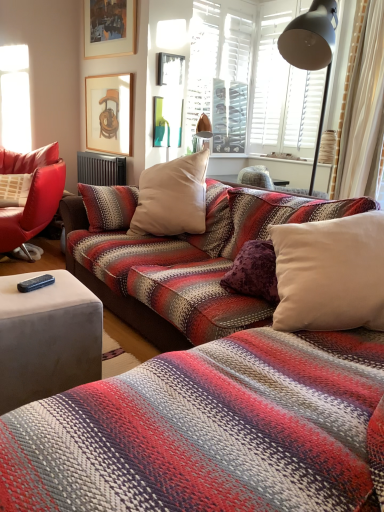
Question: Is wooden framed picture at upper left, the 3th picture frame in the top-to-bottom sequence, turned away from dark gray metallic radiator at center?

Choices:
 (A) yes
 (B) no

Answer: (B)

Question: Considering the relative positions of wooden framed picture at upper left, the first picture frame in the bottom-to-top sequence, and dark gray metallic radiator at center in the image provided, is wooden framed picture at upper left, the first picture frame in the bottom-to-top sequence, to the left of dark gray metallic radiator at center from the viewer's perspective?

Choices:
 (A) yes
 (B) no

Answer: (B)

Question: Is wooden framed picture at upper left, the first picture frame in the bottom-to-top sequence, smaller than dark gray metallic radiator at center?

Choices:
 (A) yes
 (B) no

Answer: (A)

Question: Considering the relative sizes of wooden framed picture at upper left, the first picture frame in the bottom-to-top sequence, and dark gray metallic radiator at center in the image provided, is wooden framed picture at upper left, the first picture frame in the bottom-to-top sequence, thinner than dark gray metallic radiator at center?

Choices:
 (A) no
 (B) yes

Answer: (B)

Question: Is wooden framed picture at upper left, the first picture frame in the bottom-to-top sequence, to the right of dark gray metallic radiator at center from the viewer's perspective?

Choices:
 (A) yes
 (B) no

Answer: (A)

Question: From a real-world perspective, relative to wooden picture frame at upper center, marked as the 3th picture frame in a bottom-to-top arrangement, is velvet gray studio couch at lower left vertically above or below?

Choices:
 (A) below
 (B) above

Answer: (A)

Question: From the image's perspective, is velvet gray studio couch at lower left positioned above or below wooden picture frame at upper center, marked as the 3th picture frame in a bottom-to-top arrangement?

Choices:
 (A) below
 (B) above

Answer: (A)

Question: Is velvet gray studio couch at lower left wider or thinner than wooden picture frame at upper center, which is counted as the first picture frame, starting from the top?

Choices:
 (A) wide
 (B) thin

Answer: (A)

Question: Is velvet gray studio couch at lower left spatially inside wooden picture frame at upper center, which is counted as the first picture frame, starting from the top, or outside of it?

Choices:
 (A) inside
 (B) outside

Answer: (B)

Question: From a real-world perspective, relative to wooden framed picture at upper left, the 3th picture frame in the top-to-bottom sequence, is velvet gray studio couch at lower left vertically above or below?

Choices:
 (A) below
 (B) above

Answer: (A)

Question: In the image, is velvet gray studio couch at lower left on the left side or the right side of wooden framed picture at upper left, the 3th picture frame in the top-to-bottom sequence?

Choices:
 (A) right
 (B) left

Answer: (A)

Question: In terms of size, does velvet gray studio couch at lower left appear bigger or smaller than wooden framed picture at upper left, the 3th picture frame in the top-to-bottom sequence?

Choices:
 (A) big
 (B) small

Answer: (A)

Question: From the image's perspective, is velvet gray studio couch at lower left positioned above or below wooden framed picture at upper left, the 3th picture frame in the top-to-bottom sequence?

Choices:
 (A) below
 (B) above

Answer: (A)

Question: Is dark gray metallic radiator at center taller or shorter than velvet gray studio couch at lower left?

Choices:
 (A) short
 (B) tall

Answer: (B)

Question: In the image, is dark gray metallic radiator at center positioned in front of or behind velvet gray studio couch at lower left?

Choices:
 (A) behind
 (B) front

Answer: (A)